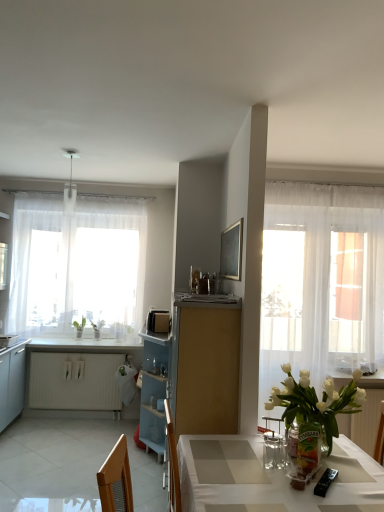
Question: Is sheer white curtain at right next to light blue plastic cabinet at center, the second cabinetry positioned from the left?

Choices:
 (A) yes
 (B) no

Answer: (B)

Question: Is sheer white curtain at right further to camera compared to light blue plastic cabinet at center, the second cabinetry positioned from the left?

Choices:
 (A) yes
 (B) no

Answer: (B)

Question: Can you confirm if sheer white curtain at right is thinner than light blue plastic cabinet at center, acting as the 2th cabinetry starting from the right?

Choices:
 (A) yes
 (B) no

Answer: (A)

Question: Considering the relative sizes of sheer white curtain at right and light blue plastic cabinet at center, the second cabinetry when ordered from front to back, in the image provided, is sheer white curtain at right bigger than light blue plastic cabinet at center, the second cabinetry when ordered from front to back,?

Choices:
 (A) yes
 (B) no

Answer: (B)

Question: Could you tell me if sheer white curtain at right is turned towards light blue plastic cabinet at center, the second cabinetry when ordered from front to back?

Choices:
 (A) no
 (B) yes

Answer: (A)

Question: From a real-world perspective, is sheer white curtain at right on top of light blue plastic cabinet at center, the second cabinetry positioned from the back?

Choices:
 (A) yes
 (B) no

Answer: (A)

Question: Can you confirm if white matte radiator at lower left, the 1th cabinetry when ordered from back to front, is smaller than white glossy microwave at left, marked as the 2th appliance in a bottom-to-top arrangement?

Choices:
 (A) yes
 (B) no

Answer: (B)

Question: Are white matte radiator at lower left, positioned as the third cabinetry in front-to-back order, and white glossy microwave at left, marked as the 1th appliance in a left-to-right arrangement, far apart?

Choices:
 (A) no
 (B) yes

Answer: (A)

Question: Is white matte radiator at lower left, the first cabinetry in the left-to-right sequence, positioned in front of white glossy microwave at left, marked as the 1th appliance in a left-to-right arrangement?

Choices:
 (A) yes
 (B) no

Answer: (B)

Question: From a real-world perspective, is white matte radiator at lower left, positioned as the third cabinetry in front-to-back order, positioned over white glossy microwave at left, placed as the 2th appliance when sorted from top to bottom, based on gravity?

Choices:
 (A) yes
 (B) no

Answer: (B)

Question: From the image's perspective, is white matte radiator at lower left, positioned as the third cabinetry in front-to-back order, over white glossy microwave at left, placed as the 2th appliance when sorted from top to bottom?

Choices:
 (A) no
 (B) yes

Answer: (A)

Question: Is white matte radiator at lower left, which appears as the 3th cabinetry when viewed from the right, behind white glossy microwave at left, the second appliance positioned from the front?

Choices:
 (A) yes
 (B) no

Answer: (A)

Question: From a real-world perspective, is white glossy microwave at left, which is the third appliance from right to left, physically above white sheer curtain at left?

Choices:
 (A) yes
 (B) no

Answer: (B)